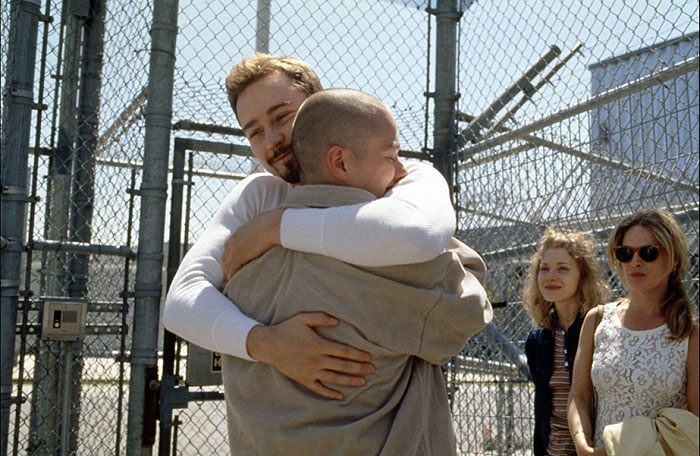
Locate an element on the screen. The width and height of the screenshot is (700, 456). speaker is located at coordinates (68, 312).